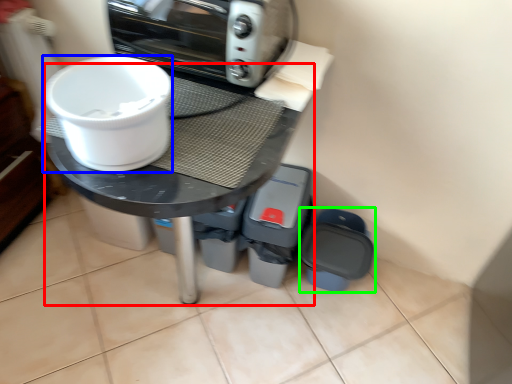
Question: Which is farther away from round table (highlighted by a red box)? toilet bowl (highlighted by a blue box) or appliance (highlighted by a green box)?

Choices:
 (A) toilet bowl
 (B) appliance

Answer: (B)